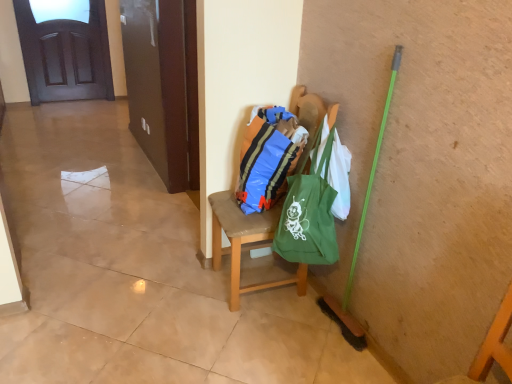
Question: Considering the relative positions of green canvas tote at center and green fabric bag at center in the image provided, is green canvas tote at center in front of green fabric bag at center?

Choices:
 (A) no
 (B) yes

Answer: (B)

Question: From the image's perspective, is green canvas tote at center on top of green fabric bag at center?

Choices:
 (A) yes
 (B) no

Answer: (A)

Question: From a real-world perspective, is green canvas tote at center under green fabric bag at center?

Choices:
 (A) no
 (B) yes

Answer: (A)

Question: Is green canvas tote at center surrounding green fabric bag at center?

Choices:
 (A) no
 (B) yes

Answer: (A)

Question: Is green canvas tote at center at the left side of green fabric bag at center?

Choices:
 (A) yes
 (B) no

Answer: (B)

Question: Is green canvas tote at center not close to green fabric bag at center?

Choices:
 (A) yes
 (B) no

Answer: (B)

Question: From a real-world perspective, is green fabric bag at center beneath dark wood door at upper left?

Choices:
 (A) no
 (B) yes

Answer: (B)

Question: From the image's perspective, is green fabric bag at center on dark wood door at upper left?

Choices:
 (A) no
 (B) yes

Answer: (A)

Question: Would you say green fabric bag at center is a long distance from dark wood door at upper left?

Choices:
 (A) no
 (B) yes

Answer: (B)

Question: Considering the relative sizes of green fabric bag at center and dark wood door at upper left in the image provided, is green fabric bag at center taller than dark wood door at upper left?

Choices:
 (A) yes
 (B) no

Answer: (B)

Question: Is green fabric bag at center in contact with dark wood door at upper left?

Choices:
 (A) yes
 (B) no

Answer: (B)

Question: Is green fabric bag at center shorter than dark wood door at upper left?

Choices:
 (A) yes
 (B) no

Answer: (A)

Question: Is green fabric bag at center smaller than blue plastic bag at center?

Choices:
 (A) no
 (B) yes

Answer: (B)